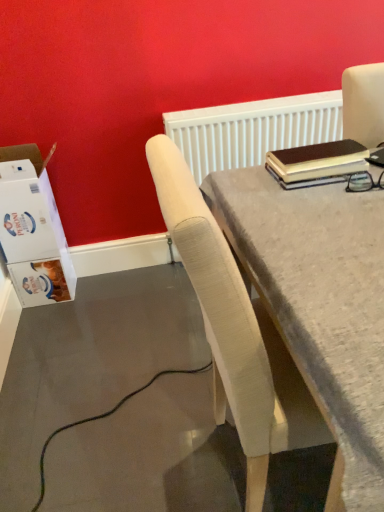
Question: Is light beige fabric chair at center a part of white textured radiator at upper center?

Choices:
 (A) yes
 (B) no

Answer: (B)

Question: Is white textured radiator at upper center oriented away from light beige fabric chair at center?

Choices:
 (A) yes
 (B) no

Answer: (B)

Question: From the image's perspective, is white textured radiator at upper center located beneath light beige fabric chair at center?

Choices:
 (A) yes
 (B) no

Answer: (B)

Question: Does white textured radiator at upper center have a lesser height compared to light beige fabric chair at center?

Choices:
 (A) yes
 (B) no

Answer: (A)

Question: Does white textured radiator at upper center lie in front of light beige fabric chair at center?

Choices:
 (A) yes
 (B) no

Answer: (B)

Question: Looking at their shapes, would you say white textured radiator at upper center is wider or thinner than white cardboard box at left?

Choices:
 (A) wide
 (B) thin

Answer: (B)

Question: Is white textured radiator at upper center spatially inside white cardboard box at left, or outside of it?

Choices:
 (A) inside
 (B) outside

Answer: (B)

Question: From a real-world perspective, is white textured radiator at upper center above or below white cardboard box at left?

Choices:
 (A) below
 (B) above

Answer: (B)

Question: Considering the positions of white textured radiator at upper center and white cardboard box at left in the image, is white textured radiator at upper center taller or shorter than white cardboard box at left?

Choices:
 (A) short
 (B) tall

Answer: (A)

Question: Is light beige fabric chair at center to the left or to the right of white cardboard box at left in the image?

Choices:
 (A) right
 (B) left

Answer: (A)

Question: From the image's perspective, is light beige fabric chair at center positioned above or below white cardboard box at left?

Choices:
 (A) above
 (B) below

Answer: (B)

Question: Considering their positions, is light beige fabric chair at center located in front of or behind white cardboard box at left?

Choices:
 (A) front
 (B) behind

Answer: (A)

Question: From a real-world perspective, is light beige fabric chair at center positioned above or below white cardboard box at left?

Choices:
 (A) below
 (B) above

Answer: (B)

Question: Is white textured radiator at upper center wider or thinner than light beige fabric chair at center?

Choices:
 (A) thin
 (B) wide

Answer: (A)

Question: In the image, is white textured radiator at upper center positioned in front of or behind light beige fabric chair at center?

Choices:
 (A) front
 (B) behind

Answer: (B)